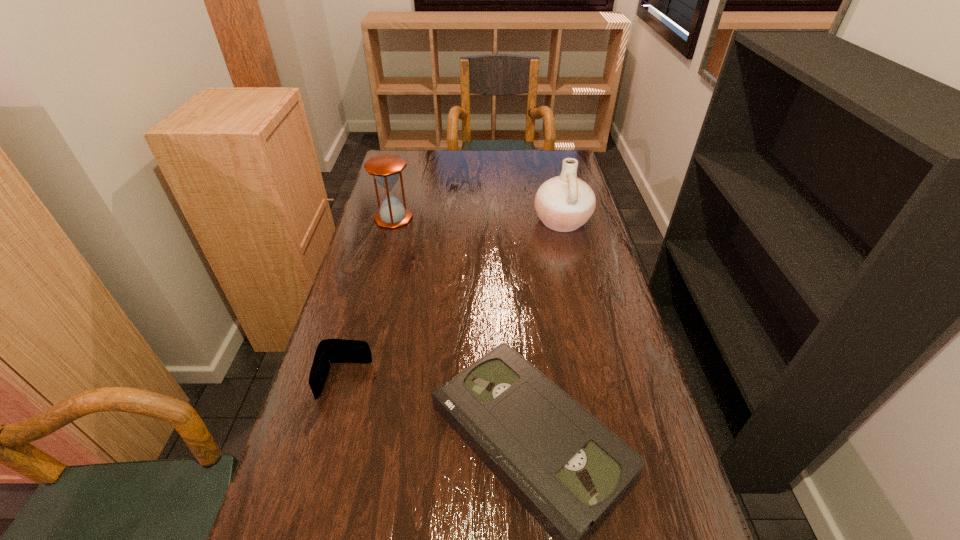
I want to click on pottery, so click(x=564, y=203).

The width and height of the screenshot is (960, 540). In order to click on hourglass in this screenshot , I will do `click(386, 169)`.

Locate an element on the screen. wallet is located at coordinates (328, 351).

I want to click on free space located 0.330m to pour from the handle of the pottery, so click(x=436, y=221).

Where is `free location located to pour from the handle of the pottery`? This screenshot has height=540, width=960. free location located to pour from the handle of the pottery is located at coordinates (518, 221).

Locate an element on the screen. blank area located to pour from the handle of the pottery is located at coordinates (503, 221).

Locate an element on the screen. vacant region located 0.070m on the back of the hourglass is located at coordinates pyautogui.click(x=398, y=197).

The image size is (960, 540). I want to click on vacant space located on the outer surface of the wallet, so click(313, 502).

Identify the location of hourglass that is at the left edge. The width and height of the screenshot is (960, 540). (386, 169).

Identify the location of wallet that is positioned at the left edge. (328, 351).